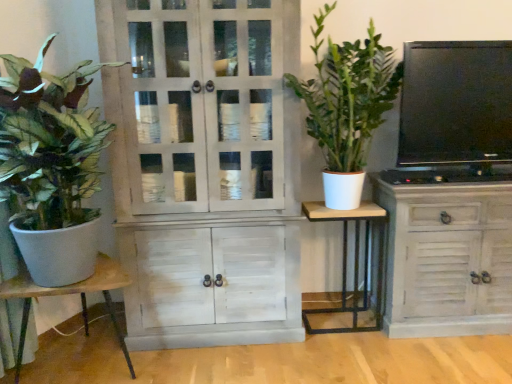
Question: In which direction should I rotate to look at white wood table at center, which is the 1th table in right-to-left order?

Choices:
 (A) left
 (B) right

Answer: (B)

Question: Considering the relative positions of white wood table at center, arranged as the 2th table when viewed from the left, and green matte plant at left, positioned as the second houseplant in right-to-left order, in the image provided, is white wood table at center, arranged as the 2th table when viewed from the left, in front of green matte plant at left, positioned as the second houseplant in right-to-left order,?

Choices:
 (A) yes
 (B) no

Answer: (B)

Question: From a real-world perspective, is white wood table at center, which is the 1th table in right-to-left order, positioned over green matte plant at left, positioned as the second houseplant in right-to-left order, based on gravity?

Choices:
 (A) yes
 (B) no

Answer: (B)

Question: From the image's perspective, does white wood table at center, arranged as the 2th table when viewed from the left, appear higher than green matte plant at left, positioned as the second houseplant in right-to-left order?

Choices:
 (A) no
 (B) yes

Answer: (A)

Question: Does white wood table at center, arranged as the 2th table when viewed from the left, appear on the left side of green matte plant at left, the 1th houseplant from the left?

Choices:
 (A) no
 (B) yes

Answer: (A)

Question: Is white wood table at center, arranged as the 2th table when viewed from the left, thinner than green matte plant at left, the 1th houseplant from the left?

Choices:
 (A) no
 (B) yes

Answer: (B)

Question: Is green matte plant at left, positioned as the second houseplant in right-to-left order, shorter than white wood cabinet at center, which is counted as the 2th cabinetry, starting from the right?

Choices:
 (A) yes
 (B) no

Answer: (A)

Question: From a real-world perspective, is green matte plant at left, the 1th houseplant from the left, under white wood cabinet at center, which is counted as the 2th cabinetry, starting from the right?

Choices:
 (A) no
 (B) yes

Answer: (A)

Question: Can you confirm if green matte plant at left, the 1th houseplant from the left, is smaller than white wood cabinet at center, which appears as the first cabinetry when viewed from the left?

Choices:
 (A) no
 (B) yes

Answer: (B)

Question: From a real-world perspective, is green matte plant at left, the 1th houseplant from the left, on white wood cabinet at center, which is counted as the 2th cabinetry, starting from the right?

Choices:
 (A) no
 (B) yes

Answer: (B)

Question: Is white wood cabinet at center, which is counted as the 2th cabinetry, starting from the right, located within green matte plant at left, the 1th houseplant from the left?

Choices:
 (A) no
 (B) yes

Answer: (A)

Question: From the image's perspective, is green matte plant at left, the 1th houseplant from the left, located above white wood cabinet at center, which is counted as the 2th cabinetry, starting from the right?

Choices:
 (A) yes
 (B) no

Answer: (A)

Question: Is green matte plant at left, positioned as the second houseplant in right-to-left order, not within wooden table at left, which is the first table from left to right?

Choices:
 (A) yes
 (B) no

Answer: (A)